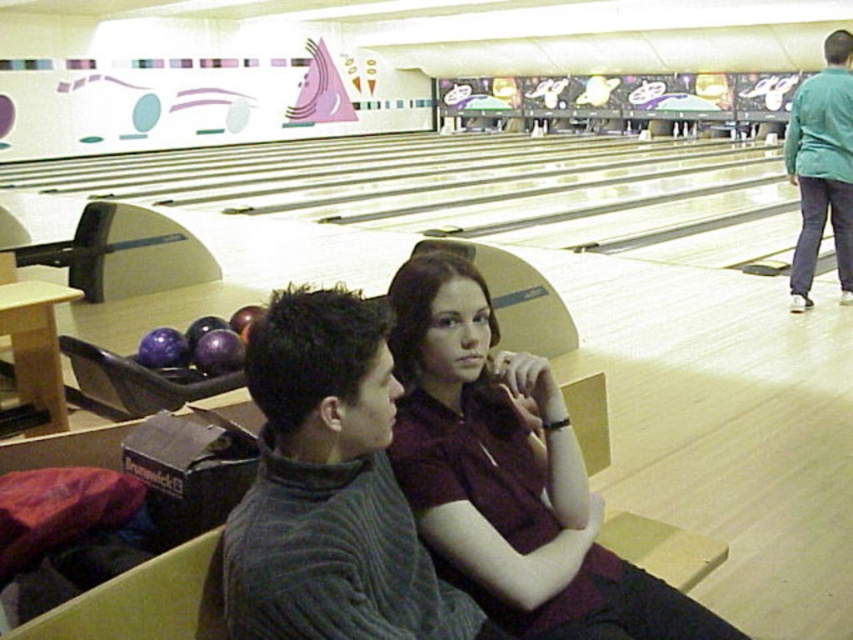
You are standing at the entrance of the bowling alley and want to find the dark gray ribbed sweater at center. Based on its 2D coordinates, in which direction should you look to locate it?

The dark gray ribbed sweater at center is located at coordinates point (329, 490), which means you should look towards the lower right direction from your current position at the entrance to find it.

You are a photographer at the bowling alley and want to capture a photo of the maroon fabric shirt at center and the green fabric shirt at upper right. Which shirt should you focus on first if you want to include both in the frame without moving the camera?

The maroon fabric shirt at center is not as tall as the green fabric shirt at upper right, so you should focus on the green fabric shirt at upper right first to ensure it fits in the frame since it is taller.

You are standing at the entrance of the bowling alley and see two points marked in the scene. Which point, point (456, 557) or point (787, 124), is closer to you?

Point (456, 557) is in front of point (787, 124), so it is closer to you.